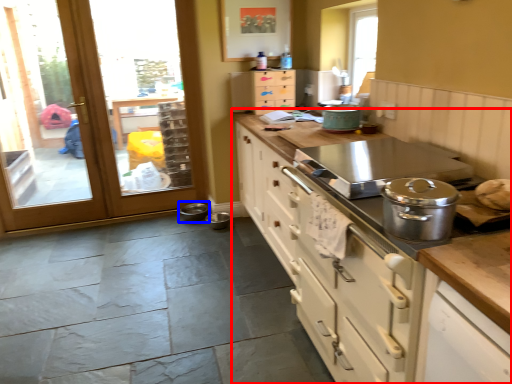
Question: Which object is closer to the camera taking this photo, cabinetry (highlighted by a red box) or appliance (highlighted by a blue box)?

Choices:
 (A) cabinetry
 (B) appliance

Answer: (A)